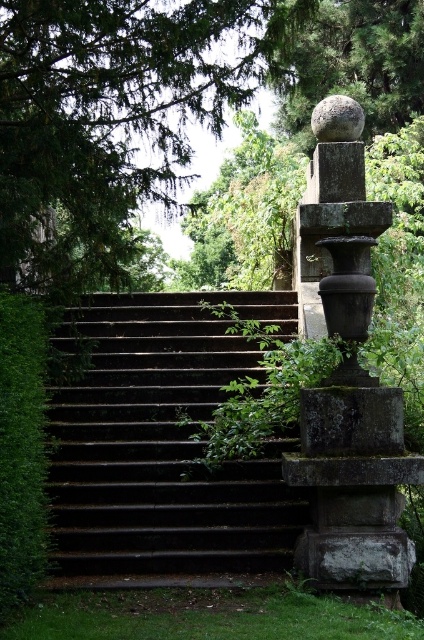
You are standing at the bottom of the stone steps and want to walk towards the green leafy tree at upper left. Which direction should you move relative to the green leafy hedge at left?

You should move to the right of the green leafy hedge at left because the green leafy tree at upper left is located to the right of the green leafy hedge at left.

You are standing at the base of the stone steps leading upwards. You want to reach the decorative stone structure on your right while avoiding the green leafy tree at upper left. Which direction should you move relative to the tree?

The green leafy tree at upper left is located at point [114,116], so you should move to the right of the tree to avoid it and head towards the decorative stone structure on your right.